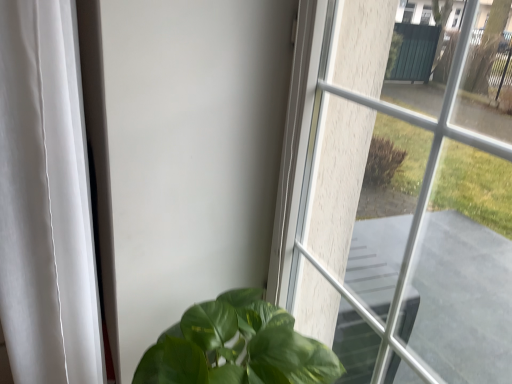
Question: Is clear glass window at center located outside white fabric curtain at left?

Choices:
 (A) yes
 (B) no

Answer: (A)

Question: Is clear glass window at center behind white fabric curtain at left?

Choices:
 (A) yes
 (B) no

Answer: (B)

Question: Is clear glass window at center positioned before white fabric curtain at left?

Choices:
 (A) yes
 (B) no

Answer: (A)

Question: Is clear glass window at center to the left of white fabric curtain at left from the viewer's perspective?

Choices:
 (A) no
 (B) yes

Answer: (A)

Question: Does clear glass window at center touch white fabric curtain at left?

Choices:
 (A) yes
 (B) no

Answer: (B)

Question: Is clear glass window at center turned away from white fabric curtain at left?

Choices:
 (A) yes
 (B) no

Answer: (B)

Question: Would you consider white fabric curtain at left to be distant from clear glass window at center?

Choices:
 (A) no
 (B) yes

Answer: (A)

Question: Could you tell me if white fabric curtain at left is turned towards clear glass window at center?

Choices:
 (A) yes
 (B) no

Answer: (B)

Question: Can you confirm if white fabric curtain at left is positioned to the right of clear glass window at center?

Choices:
 (A) yes
 (B) no

Answer: (B)

Question: Does white fabric curtain at left have a greater width compared to clear glass window at center?

Choices:
 (A) yes
 (B) no

Answer: (A)

Question: Is white fabric curtain at left further to the viewer compared to clear glass window at center?

Choices:
 (A) no
 (B) yes

Answer: (B)

Question: Is white fabric curtain at left closer to the viewer compared to clear glass window at center?

Choices:
 (A) no
 (B) yes

Answer: (A)

Question: Does point (337, 347) appear closer or farther from the camera than point (2, 48)?

Choices:
 (A) farther
 (B) closer

Answer: (A)